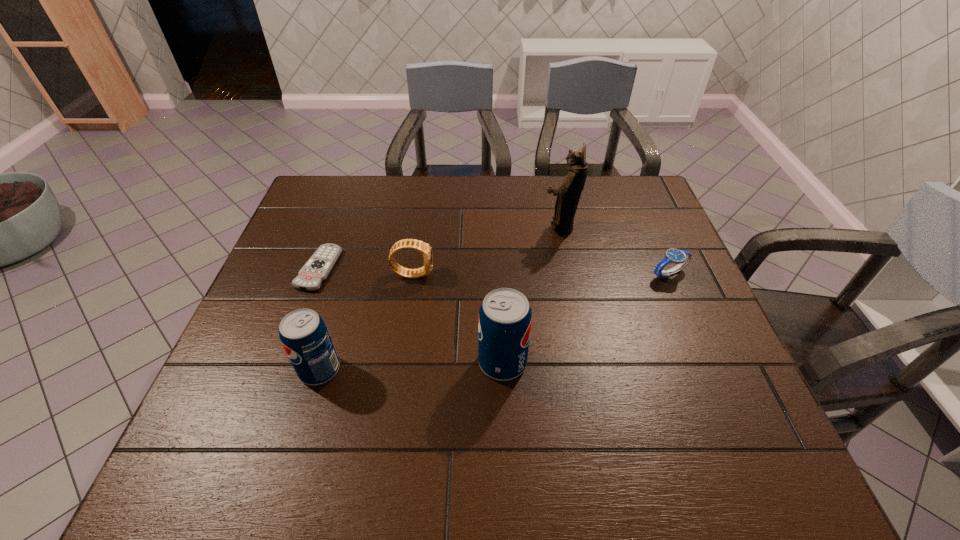
Find the location of a particular element. Image resolution: width=960 pixels, height=540 pixels. the left pop is located at coordinates (305, 338).

Locate an element on the screen. This screenshot has height=540, width=960. the shorter pop is located at coordinates 305,338.

At what (x,y) coordinates should I click in order to perform the action: click on the second tallest object. Please return your answer as a coordinate pair (x, y). The image size is (960, 540). Looking at the image, I should click on (505, 318).

Find the location of a particular element. Image resolution: width=960 pixels, height=540 pixels. the right pop is located at coordinates [505, 318].

You are a GUI agent. You are given a task and a screenshot of the screen. Output one action in this format:
    pyautogui.click(x=<x>, y=<y>)
    Task: Click on the farthest object
    
    Given the screenshot: What is the action you would take?
    pyautogui.click(x=568, y=194)

Image resolution: width=960 pixels, height=540 pixels. Identify the location of the fifth object from left to right. (568, 194).

Identify the location of the shortest object. The image size is (960, 540). (315, 271).

At what (x,y) coordinates should I click in order to perform the action: click on the third shortest object. Please return your answer as a coordinate pair (x, y). This screenshot has height=540, width=960. Looking at the image, I should click on (424, 248).

You are a GUI agent. You are given a task and a screenshot of the screen. Output one action in this format:
    pyautogui.click(x=<x>, y=<y>)
    Task: Click on the left watch
    The height and width of the screenshot is (540, 960).
    Given the screenshot: What is the action you would take?
    pyautogui.click(x=424, y=248)

Find the location of `the second shortest object`. the second shortest object is located at coordinates (681, 257).